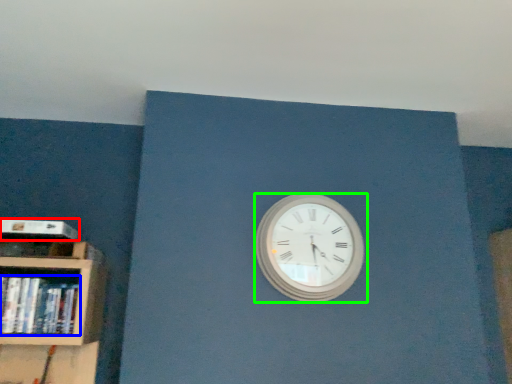
Question: Estimate the real-world distances between objects in this image. Which object is closer to paperback book (highlighted by a red box), book (highlighted by a blue box) or wall clock (highlighted by a green box)?

Choices:
 (A) book
 (B) wall clock

Answer: (A)